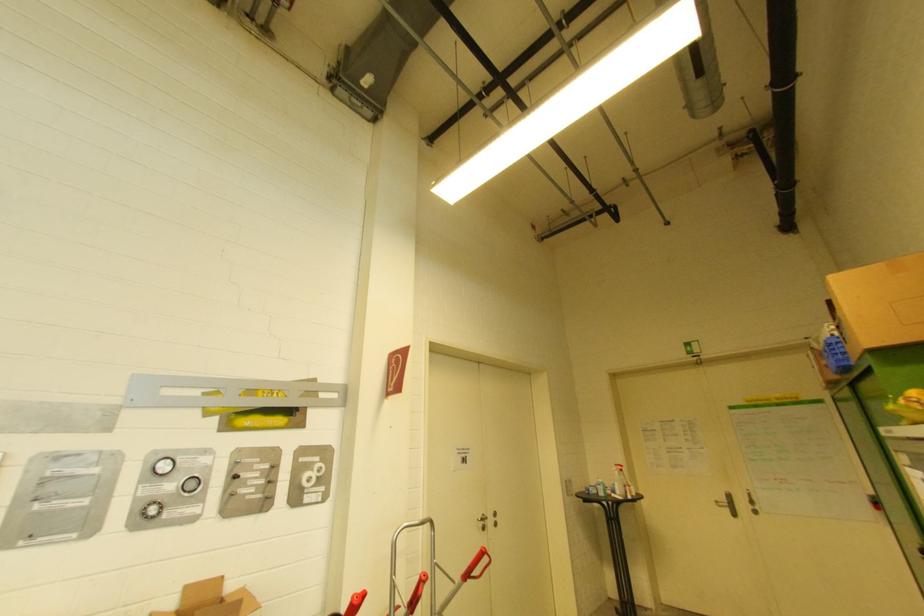
Find where to lift the blue plastic crate. Please return your answer as a coordinate pair (x, y).

(835, 355)